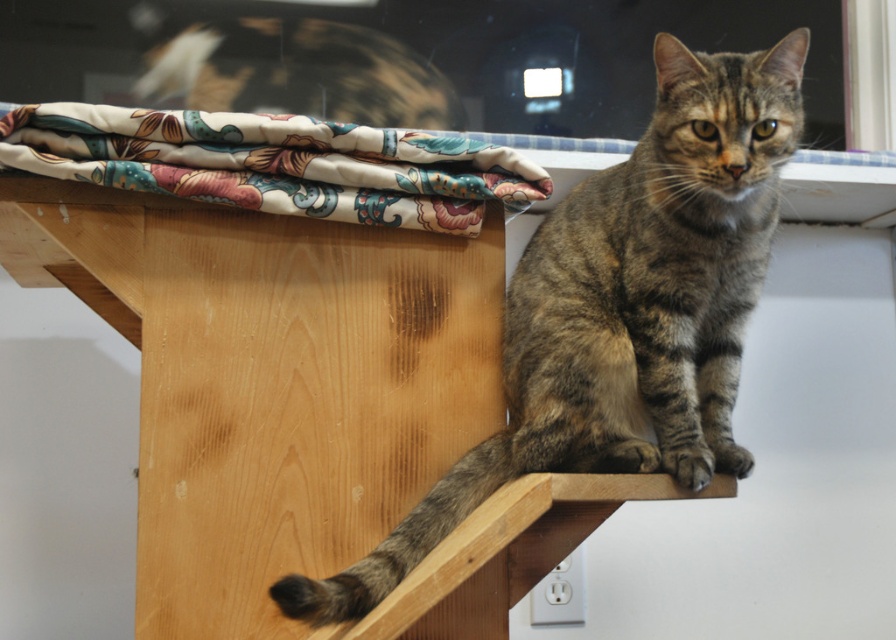
Question: Which point is farther to the camera?

Choices:
 (A) (597, 288)
 (B) (88, 108)

Answer: (A)

Question: Which of the following is the farthest from the observer?

Choices:
 (A) (153, 141)
 (B) (662, 468)

Answer: (A)

Question: Does tabby fur cat at center appear on the left side of floral fabric at upper left?

Choices:
 (A) yes
 (B) no

Answer: (B)

Question: Does tabby fur cat at center appear on the left side of floral fabric at upper left?

Choices:
 (A) no
 (B) yes

Answer: (A)

Question: Does tabby fur cat at center have a larger size compared to floral fabric at upper left?

Choices:
 (A) yes
 (B) no

Answer: (A)

Question: Which object is closer to the camera taking this photo?

Choices:
 (A) floral fabric at upper left
 (B) tabby fur cat at center

Answer: (B)